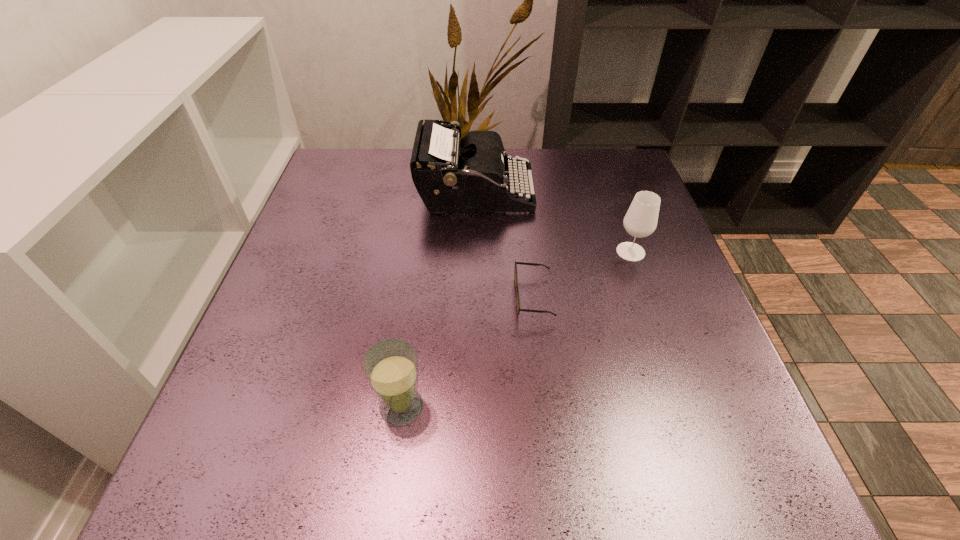
Identify the location of vacant space at the far right corner of the desktop. The image size is (960, 540). (639, 179).

Identify the location of free space between the typewriter and the nearer glass. (439, 300).

This screenshot has width=960, height=540. I want to click on free point between the rightmost object and the farthest object, so click(553, 222).

I want to click on vacant space that's between the shortest object and the nearer glass, so click(468, 352).

The height and width of the screenshot is (540, 960). Identify the location of empty space between the farthest object and the left glass. (439, 300).

You are a GUI agent. You are given a task and a screenshot of the screen. Output one action in this format:
    pyautogui.click(x=<x>, y=<y>)
    Task: Click on the free space that is in between the typewriter and the nearer glass
    The width and height of the screenshot is (960, 540).
    Given the screenshot: What is the action you would take?
    pyautogui.click(x=439, y=300)

At what (x,y) coordinates should I click in order to perform the action: click on empty space between the nearest object and the farthest object. Please return your answer as a coordinate pair (x, y). This screenshot has height=540, width=960. Looking at the image, I should click on (439, 300).

The width and height of the screenshot is (960, 540). Identify the location of vacant space in between the sunglasses and the rightmost object. (583, 274).

Identify the location of free space between the farthest object and the second nearest object. (505, 245).

I want to click on empty location between the third nearest object and the third farthest object, so click(x=583, y=274).